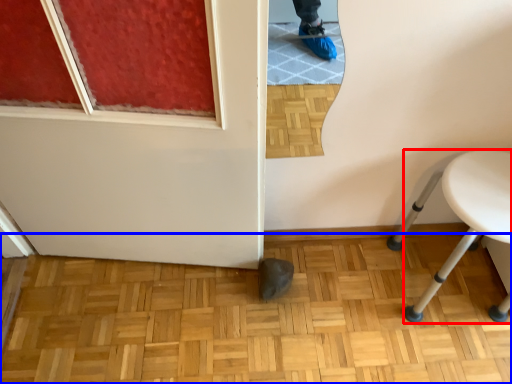
Question: Which object is closer to the camera taking this photo, furniture (highlighted by a red box) or hardwood (highlighted by a blue box)?

Choices:
 (A) furniture
 (B) hardwood

Answer: (A)